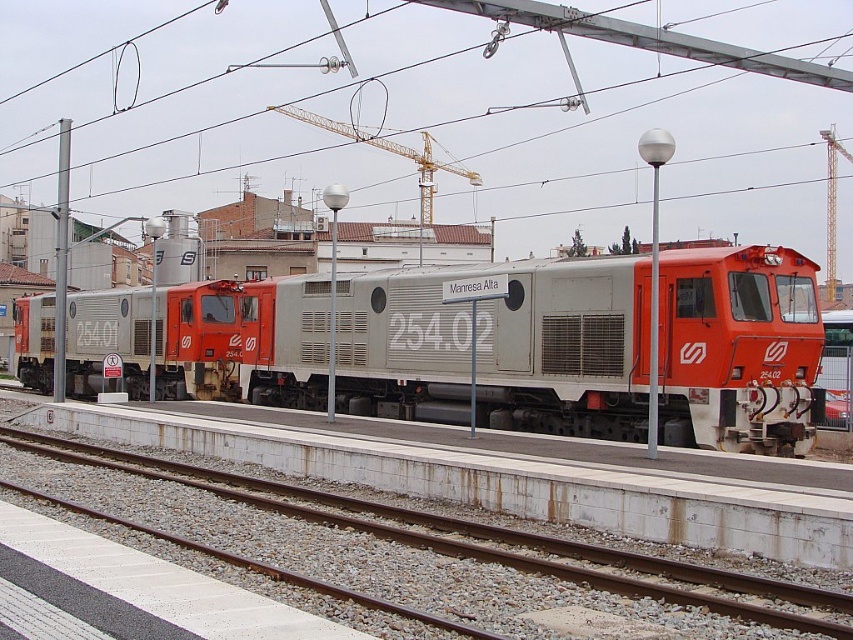
You are a railway engineer inspecting the tracks. You notice a matte gray train at center and a metallic wire at upper center. Which object is closer to the left edge of the platform?

The matte gray train at center is positioned on the left side of metallic wire at upper center, so it is closer to the left edge of the platform.

Based on the photo, you are standing at the station platform and want to reach the point marked as point (x=428, y=324). If you can walk 20 meters in 1 minute, how long will it take you to reach the point from your current position?

The distance between you and point (x=428, y=324) is 19.81 meters. Since you walk 20 meters in 1 minute, it will take approximately 1 minute to reach the point.

You are a railway inspector checking the safety distance between the metallic wire at upper center and the gray gravel train track at center. According to regulations, the minimum safe distance between such objects is 100 meters. Is the current distance compliant with the regulation?

The metallic wire at upper center and gray gravel train track at center are 134.52 meters apart, which exceeds the minimum required 100 meters, so the distance is compliant with the regulation.